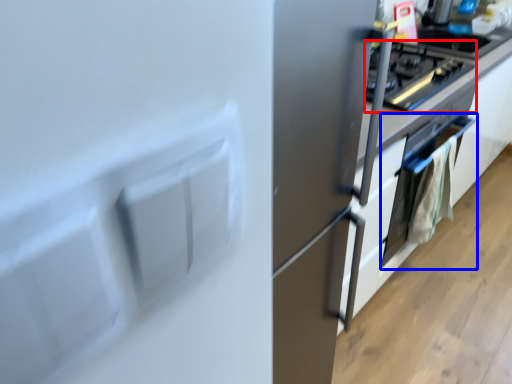
Question: Which point is further to the camera, home appliance (highlighted by a red box) or oven (highlighted by a blue box)?

Choices:
 (A) home appliance
 (B) oven

Answer: (B)